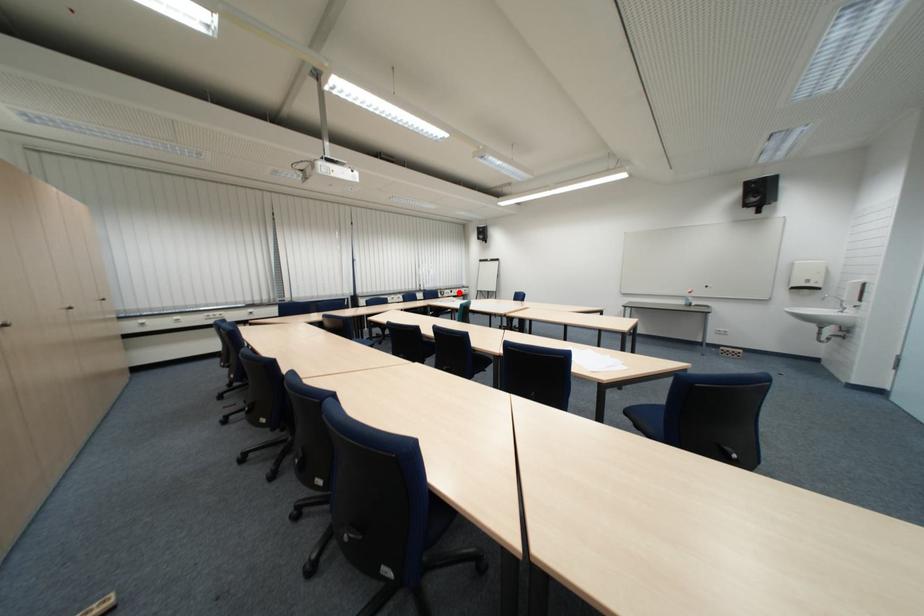
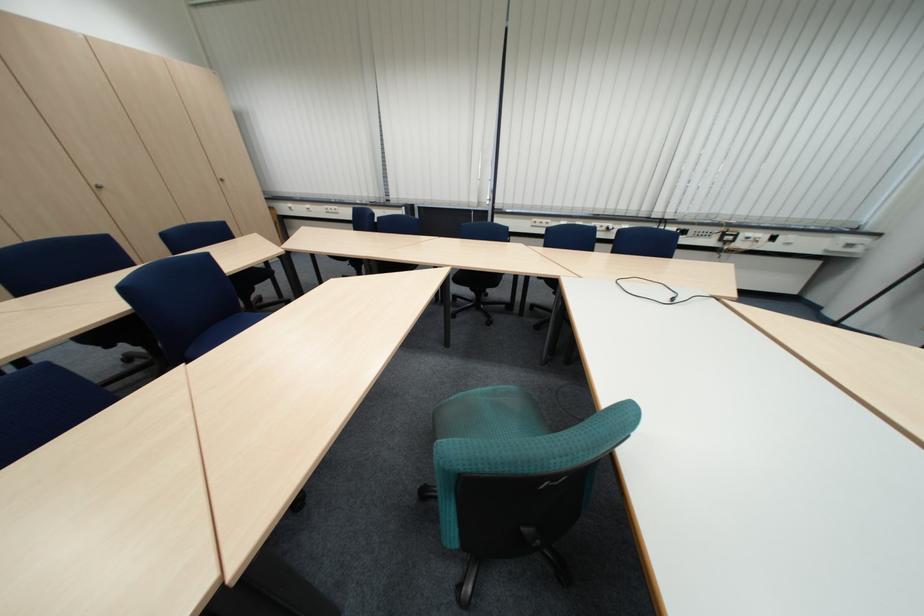
Find the pixel in the second image that matches the highlighted location in the first image.

(759, 235)